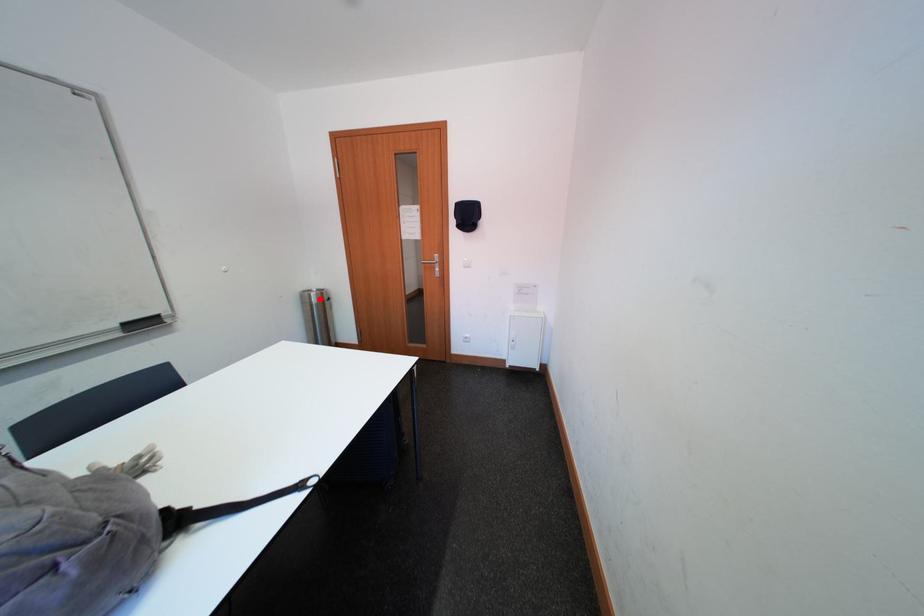
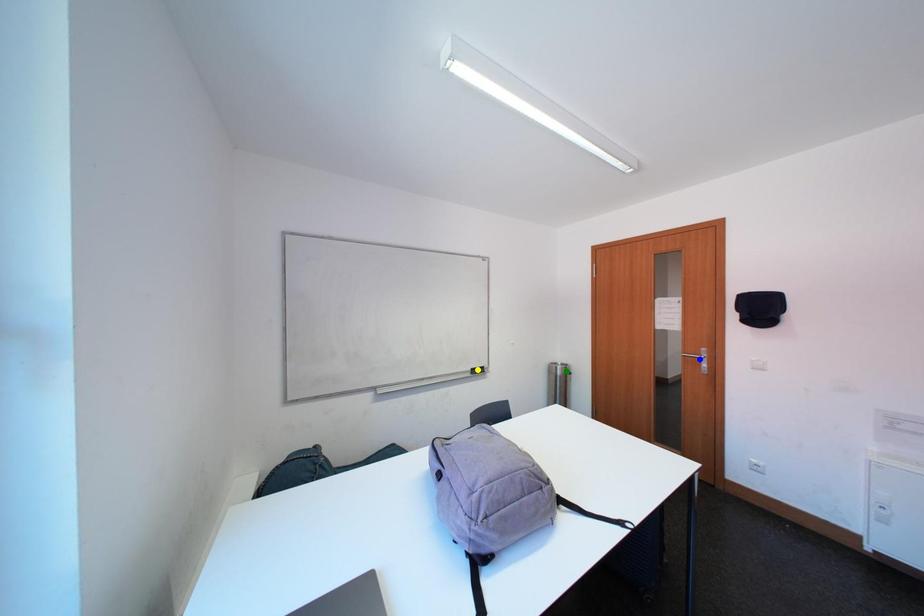
Question: I am providing you with two images of the same scene from different viewpoints. A red point is marked on the first image. You are given multiple points on the second image. Which spot in image 2 lines up with the point in image 1?

Choices:
 (A) blue point
 (B) yellow point
 (C) green point

Answer: (C)